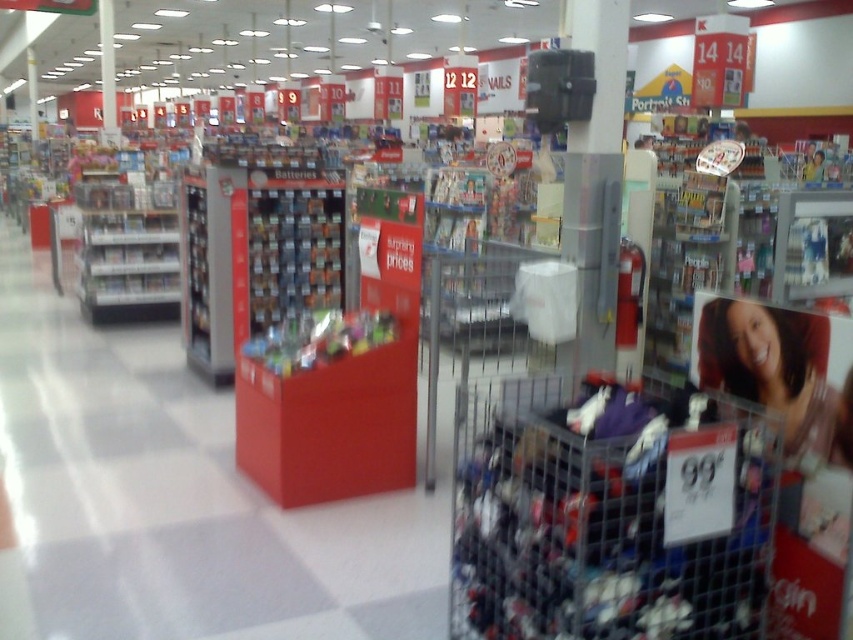
Question: Which point is farther to the camera?

Choices:
 (A) (692, 435)
 (B) (786, 355)

Answer: (B)

Question: Is metallic silver shopping cart at lower right positioned before smooth plastic photo at center?

Choices:
 (A) yes
 (B) no

Answer: (A)

Question: Which object appears farthest from the camera in this image?

Choices:
 (A) smooth plastic photo at center
 (B) metallic silver shopping cart at lower right

Answer: (A)

Question: Can you confirm if metallic silver shopping cart at lower right is wider than smooth plastic photo at center?

Choices:
 (A) yes
 (B) no

Answer: (A)

Question: Which object is closer to the camera taking this photo?

Choices:
 (A) smooth plastic photo at center
 (B) metallic silver shopping cart at lower right

Answer: (B)

Question: Does metallic silver shopping cart at lower right appear on the right side of smooth plastic photo at center?

Choices:
 (A) yes
 (B) no

Answer: (B)